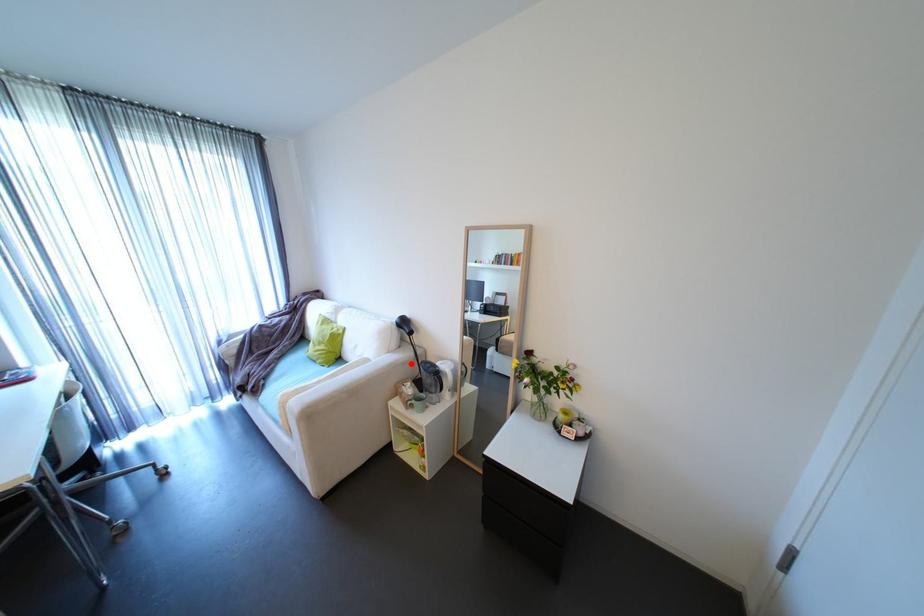
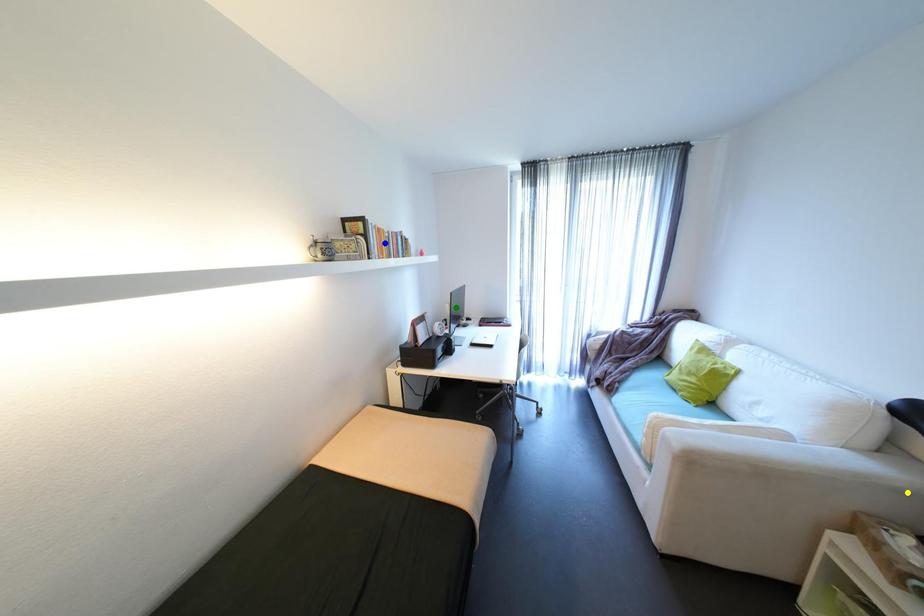
Question: I am providing you with two images of the same scene from different viewpoints. A red point is marked on the first image. You are given multiple points on the second image. Which point in image 2 is actually the same real-world point as the red point in image 1?

Choices:
 (A) green point
 (B) blue point
 (C) yellow point

Answer: (C)